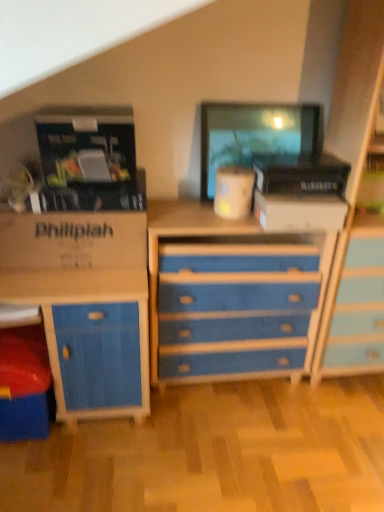
Question: From a real-world perspective, does white cardboard box at center stand above brown cardboard box at left?

Choices:
 (A) no
 (B) yes

Answer: (B)

Question: From the image's perspective, is white cardboard box at center beneath brown cardboard box at left?

Choices:
 (A) no
 (B) yes

Answer: (A)

Question: Can you confirm if white cardboard box at center is positioned to the right of brown cardboard box at left?

Choices:
 (A) no
 (B) yes

Answer: (B)

Question: Considering the relative sizes of white cardboard box at center and brown cardboard box at left in the image provided, is white cardboard box at center wider than brown cardboard box at left?

Choices:
 (A) no
 (B) yes

Answer: (B)

Question: Is white cardboard box at center further to the viewer compared to brown cardboard box at left?

Choices:
 (A) yes
 (B) no

Answer: (A)

Question: Is brown cardboard box at left to the left or to the right of white cardboard box at center in the image?

Choices:
 (A) right
 (B) left

Answer: (B)

Question: Choose the correct answer: Is brown cardboard box at left inside white cardboard box at center or outside it?

Choices:
 (A) outside
 (B) inside

Answer: (A)

Question: Based on their sizes in the image, would you say brown cardboard box at left is bigger or smaller than white cardboard box at center?

Choices:
 (A) small
 (B) big

Answer: (B)

Question: In the image, is brown cardboard box at left positioned in front of or behind white cardboard box at center?

Choices:
 (A) front
 (B) behind

Answer: (A)

Question: Based on their sizes in the image, would you say blue painted wood chest of drawers at center is bigger or smaller than brown cardboard box at left?

Choices:
 (A) big
 (B) small

Answer: (A)

Question: In the image, is blue painted wood chest of drawers at center on the left side or the right side of brown cardboard box at left?

Choices:
 (A) left
 (B) right

Answer: (B)

Question: From a real-world perspective, is blue painted wood chest of drawers at center above or below brown cardboard box at left?

Choices:
 (A) below
 (B) above

Answer: (A)

Question: Is blue painted wood chest of drawers at center wider or thinner than brown cardboard box at left?

Choices:
 (A) thin
 (B) wide

Answer: (B)

Question: From a real-world perspective, relative to white cardboard box at center, is blue painted wood chest of drawers at center vertically above or below?

Choices:
 (A) below
 (B) above

Answer: (A)

Question: Considering the positions of blue painted wood chest of drawers at center and white cardboard box at center in the image, is blue painted wood chest of drawers at center bigger or smaller than white cardboard box at center?

Choices:
 (A) small
 (B) big

Answer: (B)